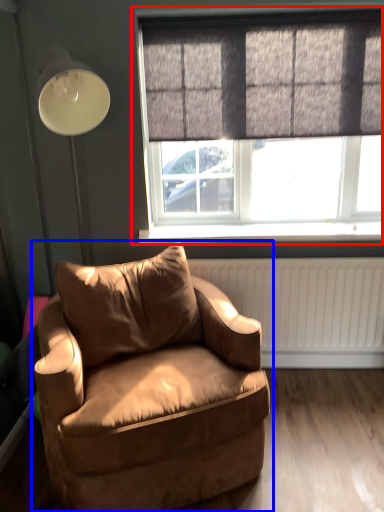
Question: Among these objects, which one is nearest to the camera, window (highlighted by a red box) or chair (highlighted by a blue box)?

Choices:
 (A) window
 (B) chair

Answer: (B)